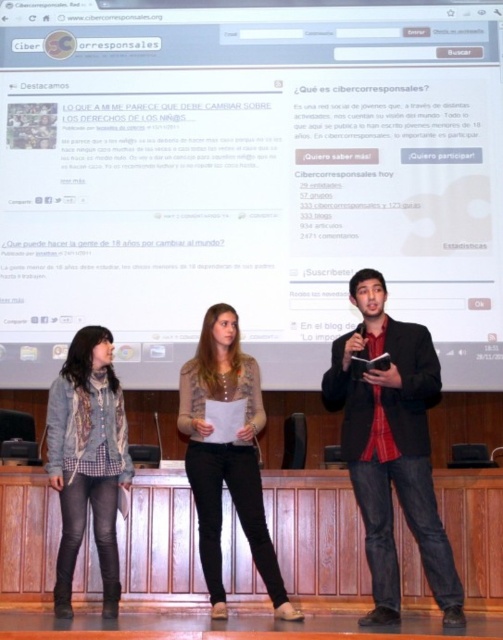
What is the relationship in size between the white glossy projection screen at upper center and the matte black blazer at center?

The white glossy projection screen at upper center is smaller than the matte black blazer at center.

You are an event planner setting up for a presentation. You need to position a projector that requires a clear line of sight to the white glossy projection screen at upper center. Are there any obstacles between the projector and the screen based on the scene description?

The white glossy projection screen at upper center is located at point (248, 179). Since the scene description mentions three individuals standing on the stage in front of the screen, there could be potential obstacles such as the people themselves or items they are holding like the microphone or notebook. However, the exact positioning of the projector and the screen must be considered to determine if the line of sight is blocked.